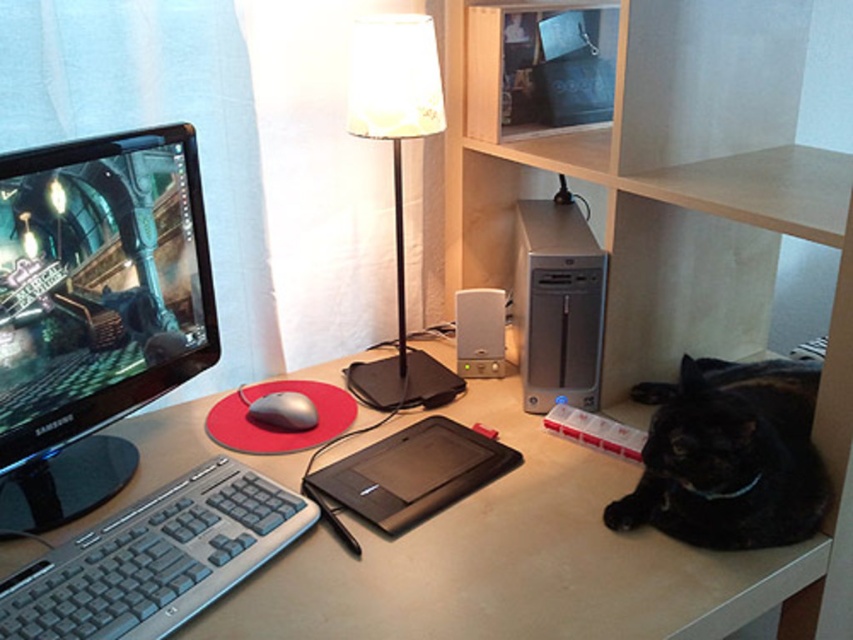
You are organizing cables in the home office and need to route them from point A at point (65, 561) to point B at point (701, 394). Considering the desk layout described, which direction should you move from point A to reach point B?

To move from point A at point (65, 561) to point B at point (701, 394), you should move backward since point A is in front of point B according to the desk layout.

You are sitting at the desk in the home office and want to reach both the point at coordinates point (335, 556) and point (468, 492). Which point is closer to you?

Point (335, 556) is closer to you because it is in front of point (468, 492).

You are a delivery person who needs to place a small package on the desk in the image. The package must be placed exactly at the coordinates indicated by point (514, 563). What object will the package be placed on?

The package will be placed on the matte white table at center, as point (514, 563) marks that location.